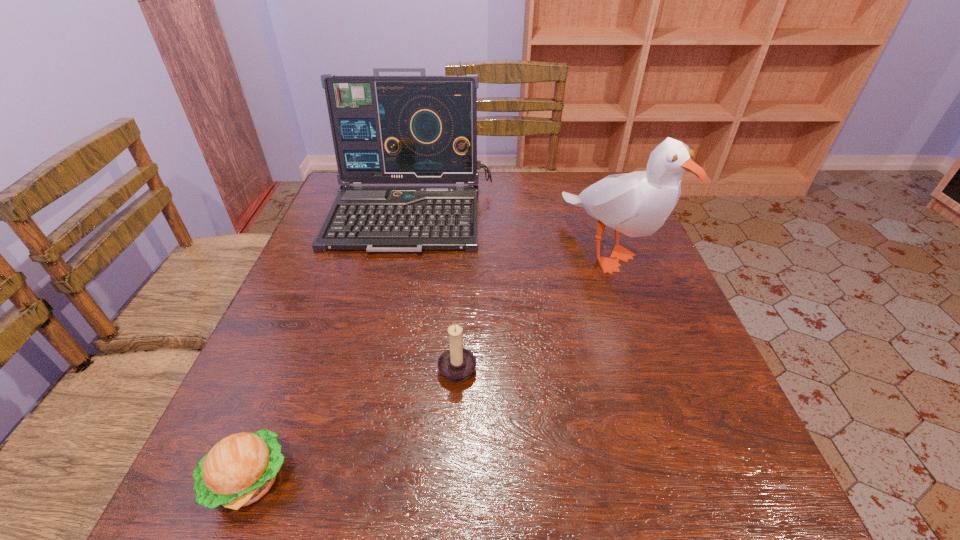
Where is `laptop computer located in the far edge section of the desktop`? This screenshot has height=540, width=960. laptop computer located in the far edge section of the desktop is located at coordinates (422, 129).

The image size is (960, 540). What are the coordinates of `gull present at the far edge` in the screenshot? It's located at (637, 204).

Locate an element on the screen. The height and width of the screenshot is (540, 960). object that is positioned at the near edge is located at coordinates (241, 468).

The height and width of the screenshot is (540, 960). I want to click on laptop computer positioned at the left edge, so click(x=422, y=129).

This screenshot has height=540, width=960. Find the location of `hamburger that is at the left edge`. hamburger that is at the left edge is located at coordinates (241, 468).

You are a GUI agent. You are given a task and a screenshot of the screen. Output one action in this format:
    pyautogui.click(x=<x>, y=<y>)
    Task: Click on the object located in the right edge section of the desktop
    Image resolution: width=960 pixels, height=540 pixels.
    Given the screenshot: What is the action you would take?
    pyautogui.click(x=637, y=204)

At what (x,y) coordinates should I click in order to perform the action: click on object that is positioned at the far left corner. Please return your answer as a coordinate pair (x, y). Looking at the image, I should click on (422, 129).

Image resolution: width=960 pixels, height=540 pixels. Find the location of `object present at the near left corner`. object present at the near left corner is located at coordinates pyautogui.click(x=241, y=468).

The image size is (960, 540). I want to click on object that is at the far right corner, so (x=637, y=204).

In the image, there is a desktop. At what (x,y) coordinates should I click in order to perform the action: click on free region at the far edge. Please return your answer as a coordinate pair (x, y). The image size is (960, 540). Looking at the image, I should click on (518, 173).